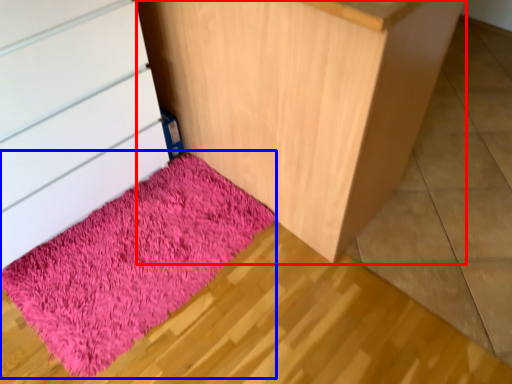
Question: Which object is further to the camera taking this photo, furniture (highlighted by a red box) or mat (highlighted by a blue box)?

Choices:
 (A) furniture
 (B) mat

Answer: (B)